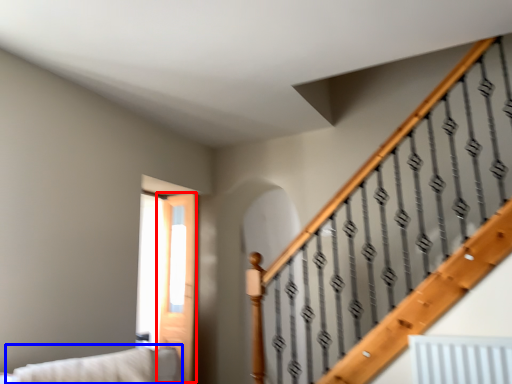
Question: Which of the following is the farthest to the observer, screen door (highlighted by a red box) or couch (highlighted by a blue box)?

Choices:
 (A) screen door
 (B) couch

Answer: (A)